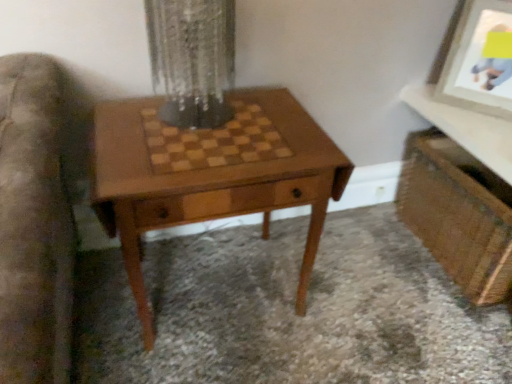
Locate an element on the screen. The height and width of the screenshot is (384, 512). free spot in front of clear glass vase at center is located at coordinates (183, 158).